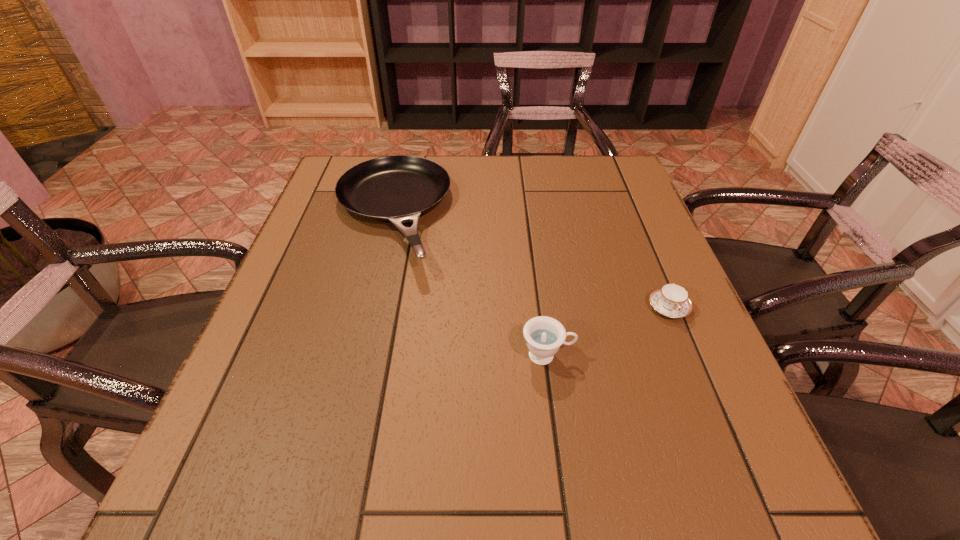
In order to click on the farthest object in this screenshot , I will do `click(399, 188)`.

This screenshot has width=960, height=540. What are the coordinates of `pan` in the screenshot? It's located at (399, 188).

You are a GUI agent. You are given a task and a screenshot of the screen. Output one action in this format:
    pyautogui.click(x=<x>, y=<y>)
    Task: Click on the nearer teacup
    The image size is (960, 540).
    Given the screenshot: What is the action you would take?
    pyautogui.click(x=544, y=335)

What are the coordinates of `the second object from left to right` in the screenshot? It's located at (544, 335).

Where is `the second nearest object`? the second nearest object is located at coordinates (671, 300).

The image size is (960, 540). Identify the location of the shorter teacup. (671, 300).

Locate an element on the screen. Image resolution: width=960 pixels, height=540 pixels. free space located on the front of the leftmost object is located at coordinates (349, 383).

Locate an element on the screen. The image size is (960, 540). vacant space located on the side of the nearer teacup with the handle is located at coordinates (x=617, y=355).

You are a GUI agent. You are given a task and a screenshot of the screen. Output one action in this format:
    pyautogui.click(x=<x>, y=<y>)
    Task: Click on the vacant position located 0.210m on the side with the handle of the right teacup
    This screenshot has width=960, height=540.
    Given the screenshot: What is the action you would take?
    pyautogui.click(x=716, y=422)

Where is `object at the far edge`? The image size is (960, 540). object at the far edge is located at coordinates 399,188.